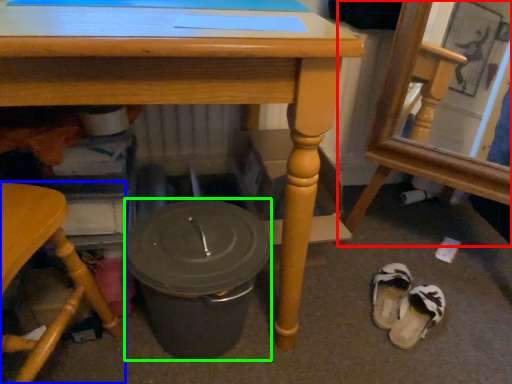
Question: Which object is positioned closest to chair (highlighted by a red box)? Select from chair (highlighted by a blue box) and crock pot (highlighted by a green box).

Choices:
 (A) chair
 (B) crock pot

Answer: (B)